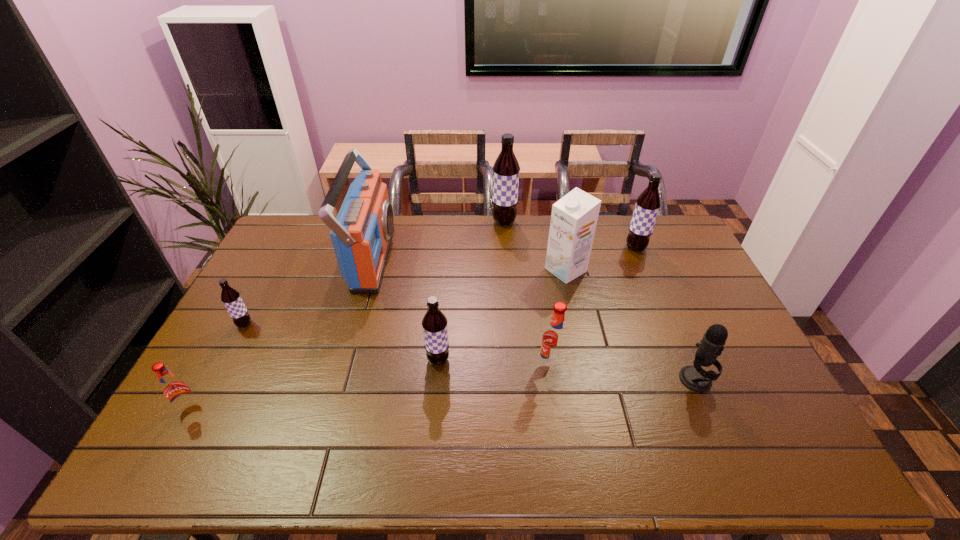
Locate an element on the screen. The height and width of the screenshot is (540, 960). blank area located 0.100m on the front of the third root beer from left to right is located at coordinates (435, 402).

You are a GUI agent. You are given a task and a screenshot of the screen. Output one action in this format:
    pyautogui.click(x=<x>, y=<y>)
    Task: Click on the vacant space located 0.230m on the right of the fifth root beer from left to right
    The height and width of the screenshot is (540, 960).
    Given the screenshot: What is the action you would take?
    pyautogui.click(x=645, y=366)

You are a GUI agent. You are given a task and a screenshot of the screen. Output one action in this format:
    pyautogui.click(x=<x>, y=<y>)
    Task: Click on the blank area located on the back of the black microphone
    The image size is (960, 540).
    Given the screenshot: What is the action you would take?
    pyautogui.click(x=668, y=316)

Identify the location of vacant space positioned on the front of the nearest object. (155, 472).

The image size is (960, 540). In order to click on vacant space located on the right of the fifth nearest object in this screenshot , I will do `click(368, 325)`.

Locate an element on the screen. Image resolution: width=960 pixels, height=540 pixels. radio receiver at the far edge is located at coordinates (361, 234).

The height and width of the screenshot is (540, 960). Identify the location of root beer located in the right edge section of the desktop. (648, 203).

This screenshot has height=540, width=960. I want to click on microphone present at the right edge, so click(695, 378).

Locate an element on the screen. The height and width of the screenshot is (540, 960). object located at the far right corner is located at coordinates (648, 203).

What are the coordinates of `vacant area at the near edge` in the screenshot? It's located at (698, 462).